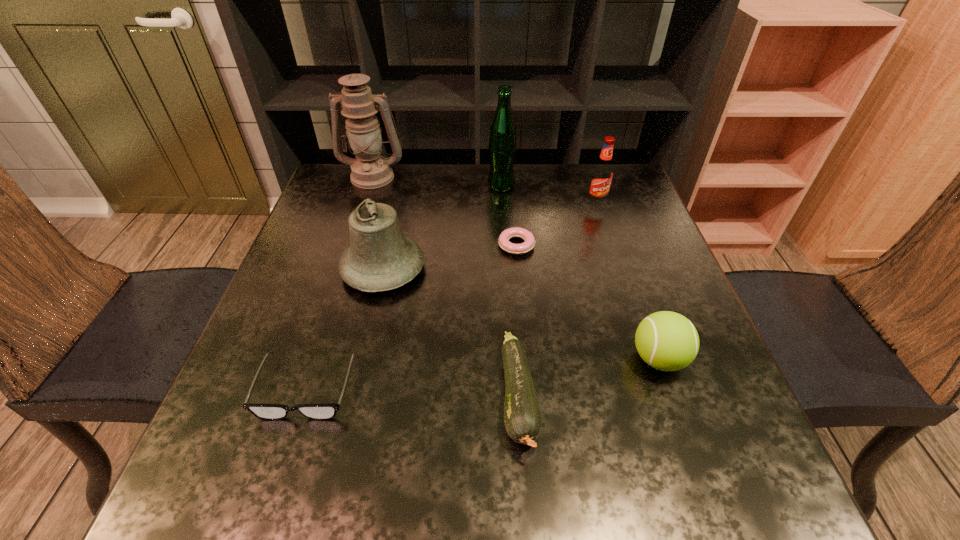
In the image, there is a desktop. Where is `free region at the right edge`? The image size is (960, 540). free region at the right edge is located at coordinates (606, 275).

At what (x,y) coordinates should I click in order to perform the action: click on blank area at the far left corner. Please return your answer as a coordinate pair (x, y). This screenshot has height=540, width=960. Looking at the image, I should click on (337, 166).

In the image, there is a desktop. Identify the location of free space at the near right corner. The height and width of the screenshot is (540, 960). (696, 498).

Find the location of `vacant area that lies between the sixth tallest object and the beer bottle`. vacant area that lies between the sixth tallest object and the beer bottle is located at coordinates (510, 292).

Find the location of a particular element. free space that is in between the fifth tallest object and the doughnut is located at coordinates (588, 302).

Locate an element on the screen. vacant area between the fourth shortest object and the spectacles is located at coordinates (483, 373).

In order to click on free space between the shortest object and the tennis ball in this screenshot , I will do `click(588, 302)`.

The width and height of the screenshot is (960, 540). What are the coordinates of `vacant region between the sixth nearest object and the oil lamp` in the screenshot? It's located at (485, 190).

The width and height of the screenshot is (960, 540). I want to click on free space between the fifth tallest object and the zucchini, so click(x=588, y=378).

Find the location of a particular element. The image size is (960, 540). vacant space that is in between the second shortest object and the oil lamp is located at coordinates (340, 282).